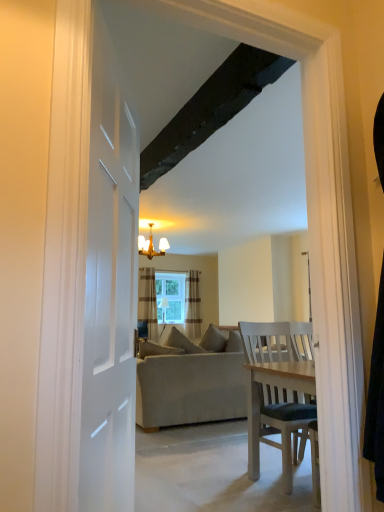
Question: Is gold metallic chandelier at upper center bigger than clear glass window at center?

Choices:
 (A) yes
 (B) no

Answer: (A)

Question: From a real-world perspective, is gold metallic chandelier at upper center positioned under clear glass window at center based on gravity?

Choices:
 (A) no
 (B) yes

Answer: (A)

Question: Considering the relative sizes of gold metallic chandelier at upper center and clear glass window at center in the image provided, is gold metallic chandelier at upper center shorter than clear glass window at center?

Choices:
 (A) no
 (B) yes

Answer: (B)

Question: Does gold metallic chandelier at upper center have a lesser width compared to clear glass window at center?

Choices:
 (A) no
 (B) yes

Answer: (A)

Question: Does gold metallic chandelier at upper center touch clear glass window at center?

Choices:
 (A) no
 (B) yes

Answer: (A)

Question: Is clear glass window at center in front of or behind striped fabric curtain at center, the 2th curtain in the left-to-right sequence, in the image?

Choices:
 (A) behind
 (B) front

Answer: (A)

Question: Does point (175, 287) appear closer or farther from the camera than point (193, 309)?

Choices:
 (A) closer
 (B) farther

Answer: (A)

Question: From a real-world perspective, relative to striped fabric curtain at center, the 2th curtain in the left-to-right sequence, is clear glass window at center vertically above or below?

Choices:
 (A) below
 (B) above

Answer: (B)

Question: Is clear glass window at center taller or shorter than striped fabric curtain at center, the 2th curtain in the left-to-right sequence?

Choices:
 (A) tall
 (B) short

Answer: (B)

Question: Considering the positions of clear glass window at center and beige fabric couch at center in the image, is clear glass window at center wider or thinner than beige fabric couch at center?

Choices:
 (A) thin
 (B) wide

Answer: (A)

Question: In terms of height, does clear glass window at center look taller or shorter compared to beige fabric couch at center?

Choices:
 (A) tall
 (B) short

Answer: (B)

Question: Is clear glass window at center spatially inside beige fabric couch at center, or outside of it?

Choices:
 (A) inside
 (B) outside

Answer: (B)

Question: From the image's perspective, is clear glass window at center positioned above or below beige fabric couch at center?

Choices:
 (A) below
 (B) above

Answer: (B)

Question: Considering the positions of gold metallic chandelier at upper center and striped fabric curtain at center, positioned as the 1th curtain in right-to-left order, in the image, is gold metallic chandelier at upper center wider or thinner than striped fabric curtain at center, positioned as the 1th curtain in right-to-left order,?

Choices:
 (A) thin
 (B) wide

Answer: (B)

Question: In the image, is gold metallic chandelier at upper center on the left side or the right side of striped fabric curtain at center, positioned as the 1th curtain in right-to-left order?

Choices:
 (A) right
 (B) left

Answer: (B)